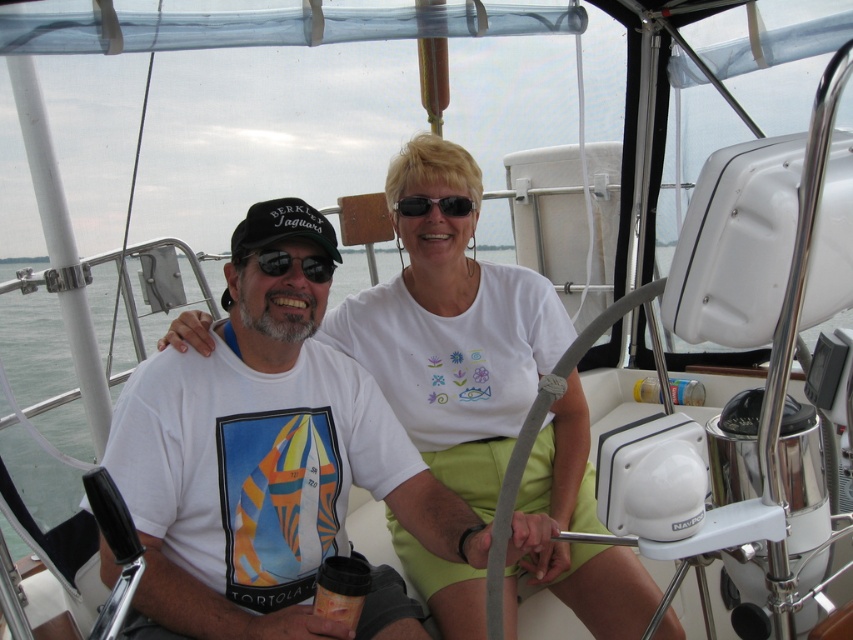
You are standing at point point (285,268) and want to take a photo of the two people in the sailboat cockpit. If your camera is 1.94 meters away from you, will it capture both individuals in the frame?

Yes, since the camera is exactly 1.94 meters away from point (285,268), it will capture both individuals as they are within the camera range.